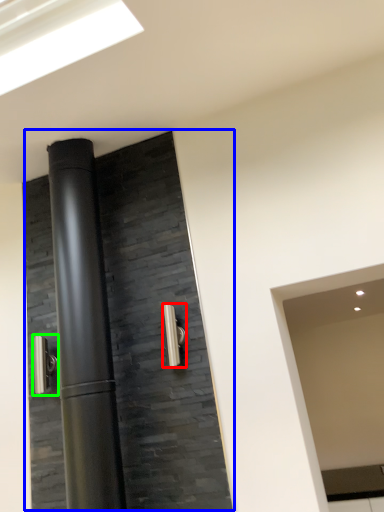
Question: Based on their relative distances, which object is nearer to door handle (highlighted by a red box)? Choose from door (highlighted by a blue box) and door handle (highlighted by a green box).

Choices:
 (A) door
 (B) door handle

Answer: (A)